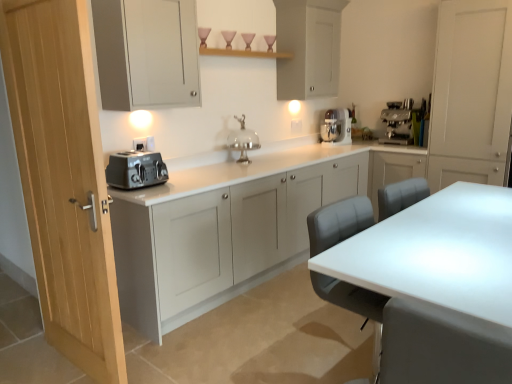
Question: Can you confirm if matte gray cabinet at upper left, the fourth cabinetry in the right-to-left sequence, is taller than matte gray cabinet at left, which is the 2th cabinetry in left-to-right order?

Choices:
 (A) no
 (B) yes

Answer: (A)

Question: Is matte gray cabinet at upper left, marked as the first cabinetry in a left-to-right arrangement, in contact with matte gray cabinet at left, which is the third cabinetry in right-to-left order?

Choices:
 (A) yes
 (B) no

Answer: (B)

Question: Is matte gray cabinet at upper left, marked as the first cabinetry in a left-to-right arrangement, behind matte gray cabinet at left, which is the third cabinetry in right-to-left order?

Choices:
 (A) yes
 (B) no

Answer: (B)

Question: Is matte gray cabinet at upper left, the fourth cabinetry in the right-to-left sequence, thinner than matte gray cabinet at left, which is the 2th cabinetry in left-to-right order?

Choices:
 (A) yes
 (B) no

Answer: (A)

Question: Does matte gray cabinet at upper left, the fourth cabinetry in the right-to-left sequence, appear on the right side of matte gray cabinet at left, which is the third cabinetry in right-to-left order?

Choices:
 (A) yes
 (B) no

Answer: (B)

Question: Considering the relative positions of silver metallic cake stand at center and matte white cabinet at upper center, which ranks as the second cabinetry in right-to-left order, in the image provided, is silver metallic cake stand at center to the left or to the right of matte white cabinet at upper center, which ranks as the second cabinetry in right-to-left order,?

Choices:
 (A) right
 (B) left

Answer: (B)

Question: From the image's perspective, is silver metallic cake stand at center positioned above or below matte white cabinet at upper center, which ranks as the second cabinetry in right-to-left order?

Choices:
 (A) below
 (B) above

Answer: (A)

Question: In terms of size, does silver metallic cake stand at center appear bigger or smaller than matte white cabinet at upper center, which ranks as the second cabinetry in right-to-left order?

Choices:
 (A) big
 (B) small

Answer: (B)

Question: Is point (234, 140) positioned closer to the camera than point (308, 26)?

Choices:
 (A) farther
 (B) closer

Answer: (A)

Question: Considering the relative positions of satin silver toaster at left and matte gray cabinet at left, which is the 2th cabinetry in left-to-right order, in the image provided, is satin silver toaster at left to the left or to the right of matte gray cabinet at left, which is the 2th cabinetry in left-to-right order,?

Choices:
 (A) right
 (B) left

Answer: (B)

Question: From the image's perspective, is satin silver toaster at left located above or below matte gray cabinet at left, which is the third cabinetry in right-to-left order?

Choices:
 (A) above
 (B) below

Answer: (A)

Question: Choose the correct answer: Is satin silver toaster at left inside matte gray cabinet at left, which is the third cabinetry in right-to-left order, or outside it?

Choices:
 (A) inside
 (B) outside

Answer: (A)

Question: In the image, is satin silver toaster at left positioned in front of or behind matte gray cabinet at left, which is the 2th cabinetry in left-to-right order?

Choices:
 (A) front
 (B) behind

Answer: (B)

Question: Is satin silver toaster at left in front of or behind silver metallic cake stand at center in the image?

Choices:
 (A) front
 (B) behind

Answer: (A)

Question: Does point (133, 178) appear closer or farther from the camera than point (259, 145)?

Choices:
 (A) closer
 (B) farther

Answer: (A)